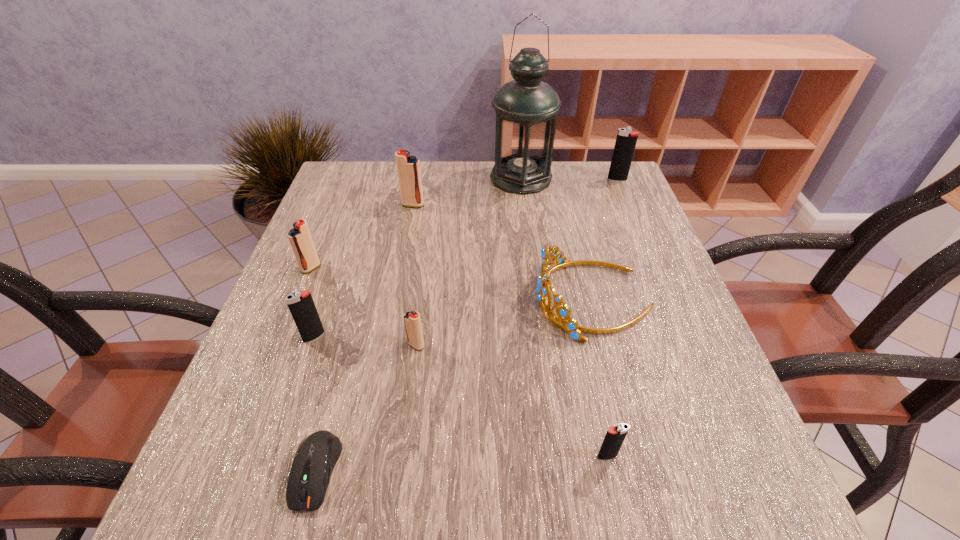
At what (x,y) coordinates should I click in order to perform the action: click on igniter positioned at the right edge. Please return your answer as a coordinate pair (x, y). The height and width of the screenshot is (540, 960). Looking at the image, I should click on (626, 139).

Where is `tiara located in the right edge section of the desktop`? tiara located in the right edge section of the desktop is located at coordinates (571, 326).

Identify the location of object present at the near left corner. This screenshot has width=960, height=540. (x=314, y=461).

Where is `object at the far right corner`? This screenshot has width=960, height=540. object at the far right corner is located at coordinates (626, 139).

The height and width of the screenshot is (540, 960). In the image, there is a desktop. In order to click on free region at the far edge in this screenshot , I will do `click(566, 200)`.

At what (x,y) coordinates should I click in order to perform the action: click on vacant space at the near edge of the desktop. Please return your answer as a coordinate pair (x, y). The width and height of the screenshot is (960, 540). Looking at the image, I should click on (439, 472).

In the image, there is a desktop. Identify the location of vacant space at the left edge. The width and height of the screenshot is (960, 540). (277, 457).

The width and height of the screenshot is (960, 540). Find the location of `vacant space at the right edge`. vacant space at the right edge is located at coordinates (634, 285).

At what (x,y) coordinates should I click in order to perform the action: click on vacant space at the far left corner of the desktop. Please return your answer as a coordinate pair (x, y). Looking at the image, I should click on (383, 202).

Identify the location of free space at the near left corner of the desktop. The image size is (960, 540). (276, 514).